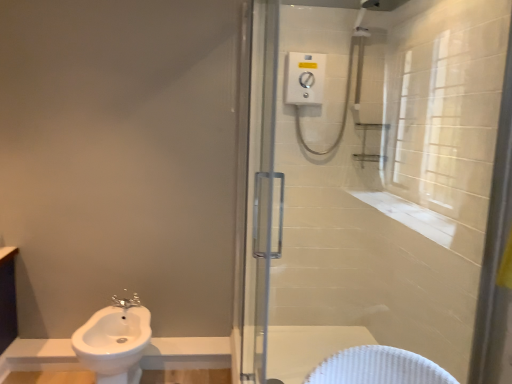
Question: Is clear glass shower door at center positioned beyond the bounds of white glossy sink at lower left?

Choices:
 (A) no
 (B) yes

Answer: (B)

Question: Does clear glass shower door at center have a lesser height compared to white glossy sink at lower left?

Choices:
 (A) no
 (B) yes

Answer: (A)

Question: Is clear glass shower door at center positioned behind white glossy sink at lower left?

Choices:
 (A) no
 (B) yes

Answer: (A)

Question: Can you confirm if clear glass shower door at center is taller than white glossy sink at lower left?

Choices:
 (A) no
 (B) yes

Answer: (B)

Question: Can you confirm if clear glass shower door at center is wider than white glossy sink at lower left?

Choices:
 (A) yes
 (B) no

Answer: (B)

Question: From the image's perspective, would you say clear glass shower door at center is positioned over white glossy sink at lower left?

Choices:
 (A) no
 (B) yes

Answer: (B)

Question: Is satin nickel faucet at lower left shorter than clear glass shower door at center?

Choices:
 (A) no
 (B) yes

Answer: (B)

Question: From the image's perspective, is satin nickel faucet at lower left located beneath clear glass shower door at center?

Choices:
 (A) yes
 (B) no

Answer: (A)

Question: Is the depth of satin nickel faucet at lower left greater than that of clear glass shower door at center?

Choices:
 (A) yes
 (B) no

Answer: (A)

Question: From the image's perspective, would you say satin nickel faucet at lower left is positioned over clear glass shower door at center?

Choices:
 (A) yes
 (B) no

Answer: (B)

Question: Is satin nickel faucet at lower left smaller than clear glass shower door at center?

Choices:
 (A) yes
 (B) no

Answer: (A)

Question: From a real-world perspective, is satin nickel faucet at lower left on clear glass shower door at center?

Choices:
 (A) no
 (B) yes

Answer: (A)

Question: From the image's perspective, is satin nickel faucet at lower left on top of white glossy sink at lower left?

Choices:
 (A) no
 (B) yes

Answer: (B)